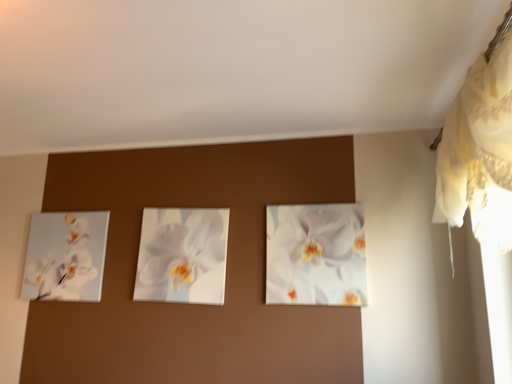
Question: From a real-world perspective, does white glossy orchid at center, which appears as the first flower when viewed from the left, stand above white glossy orchid painting at left?

Choices:
 (A) yes
 (B) no

Answer: (A)

Question: Does white glossy orchid at center, marked as the 2th flower in a right-to-left arrangement, have a larger size compared to white glossy orchid painting at left?

Choices:
 (A) no
 (B) yes

Answer: (B)

Question: Is white glossy orchid at center, which appears as the first flower when viewed from the left, located outside white glossy orchid painting at left?

Choices:
 (A) yes
 (B) no

Answer: (A)

Question: From a real-world perspective, is white glossy orchid at center, which appears as the first flower when viewed from the left, physically below white glossy orchid painting at left?

Choices:
 (A) no
 (B) yes

Answer: (A)

Question: Is white glossy orchid at center, which appears as the first flower when viewed from the left, positioned in front of white glossy orchid painting at left?

Choices:
 (A) no
 (B) yes

Answer: (B)

Question: Considering the positions of white glossy orchid at center, which is counted as the first flower, starting from the right, and white lace curtain at upper right in the image, is white glossy orchid at center, which is counted as the first flower, starting from the right, wider or thinner than white lace curtain at upper right?

Choices:
 (A) wide
 (B) thin

Answer: (B)

Question: Is point pos(274,228) positioned closer to the camera than point pos(504,173)?

Choices:
 (A) closer
 (B) farther

Answer: (B)

Question: Visually, is white glossy orchid at center, which is counted as the first flower, starting from the right, positioned to the left or to the right of white lace curtain at upper right?

Choices:
 (A) left
 (B) right

Answer: (A)

Question: In terms of height, does white glossy orchid at center, which appears as the 2th flower when viewed from the left, look taller or shorter compared to white lace curtain at upper right?

Choices:
 (A) short
 (B) tall

Answer: (A)

Question: Would you say white glossy orchid at center, which appears as the first flower when viewed from the left, is inside or outside white lace curtain at upper right?

Choices:
 (A) inside
 (B) outside

Answer: (B)

Question: Is white glossy orchid at center, marked as the 2th flower in a right-to-left arrangement, in front of or behind white lace curtain at upper right in the image?

Choices:
 (A) front
 (B) behind

Answer: (B)

Question: From their relative heights in the image, would you say white glossy orchid at center, which appears as the first flower when viewed from the left, is taller or shorter than white lace curtain at upper right?

Choices:
 (A) short
 (B) tall

Answer: (A)

Question: Is white glossy orchid at center, which appears as the first flower when viewed from the left, bigger or smaller than white lace curtain at upper right?

Choices:
 (A) big
 (B) small

Answer: (B)

Question: Considering the positions of point (360, 258) and point (202, 218), is point (360, 258) closer or farther from the camera than point (202, 218)?

Choices:
 (A) farther
 (B) closer

Answer: (B)

Question: Based on their positions, is white glossy orchid at center, which is counted as the first flower, starting from the right, located to the left or right of white glossy orchid at center, marked as the 2th flower in a right-to-left arrangement?

Choices:
 (A) right
 (B) left

Answer: (A)